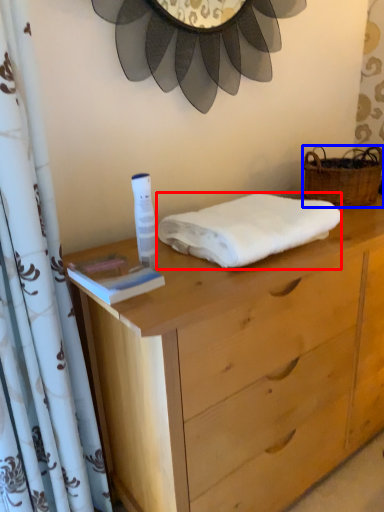
Question: Among these objects, which one is nearest to the camera, towel (highlighted by a red box) or picnic basket (highlighted by a blue box)?

Choices:
 (A) towel
 (B) picnic basket

Answer: (A)